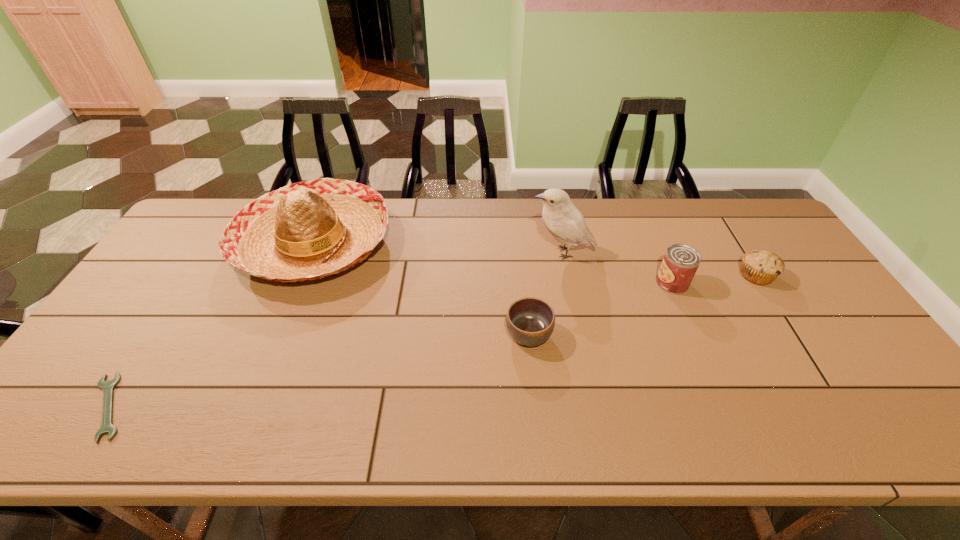
This screenshot has height=540, width=960. I want to click on free spot that satisfies the following two spatial constraints: 1. on the back side of the rightmost object; 2. on the right side of the leftmost object, so click(194, 275).

Identify the location of free space that satisfies the following two spatial constraints: 1. at the beak of the tallest object; 2. on the back side of the fourth shortest object. (568, 284).